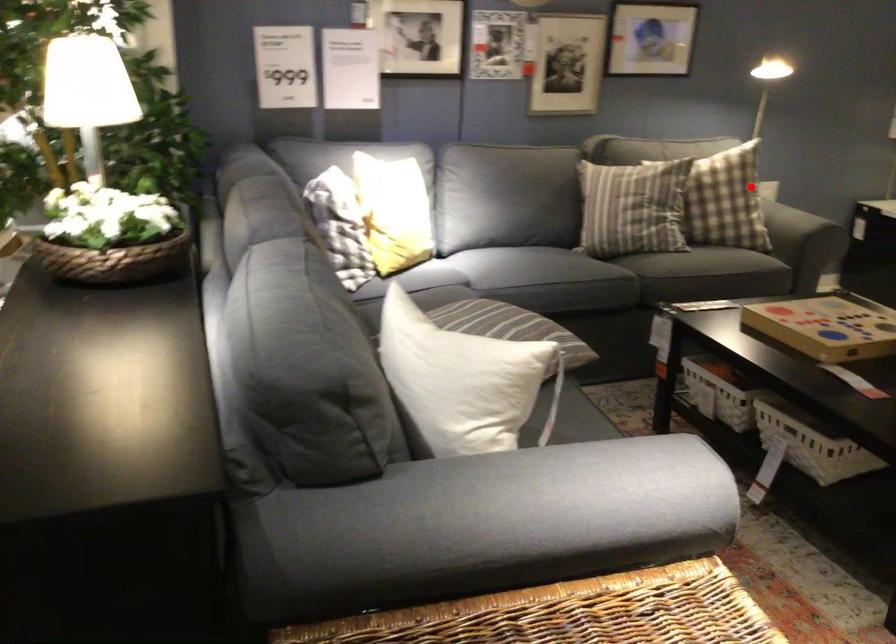
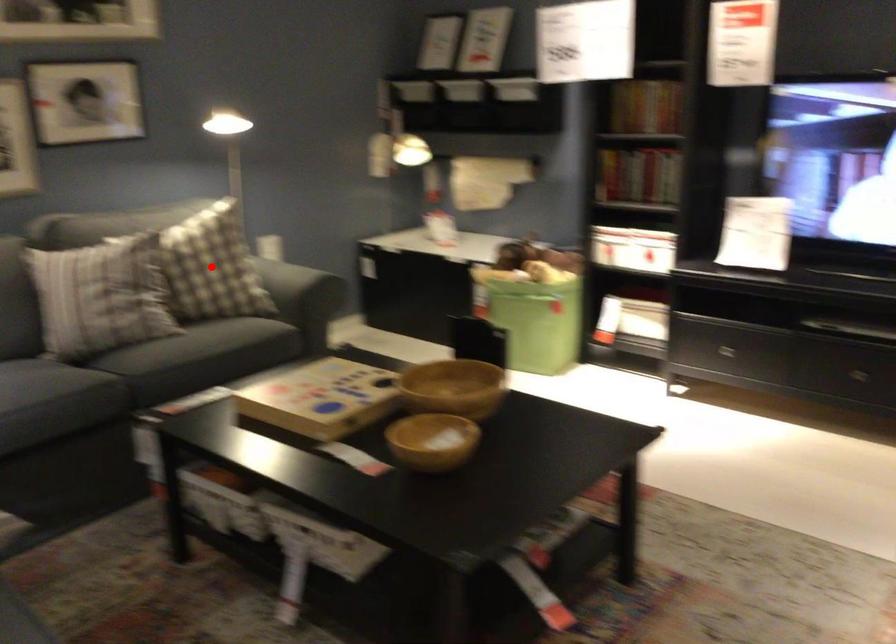
I am providing you with two images of the same scene from different viewpoints. A red point is marked on the first image and another point is marked on the second image. Do the highlighted points in image1 and image2 indicate the same real-world spot?

Yes